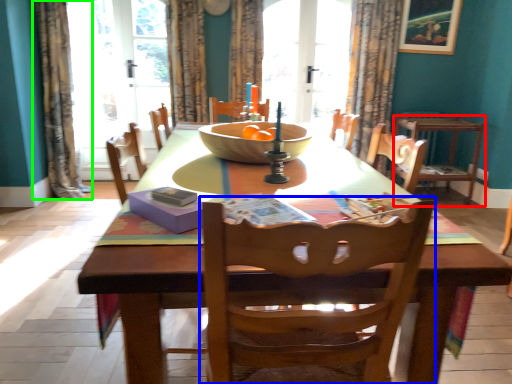
Question: Estimate the real-world distances between objects in this image. Which object is closer to chair (highlighted by a red box), chair (highlighted by a blue box) or curtain (highlighted by a green box)?

Choices:
 (A) chair
 (B) curtain

Answer: (A)